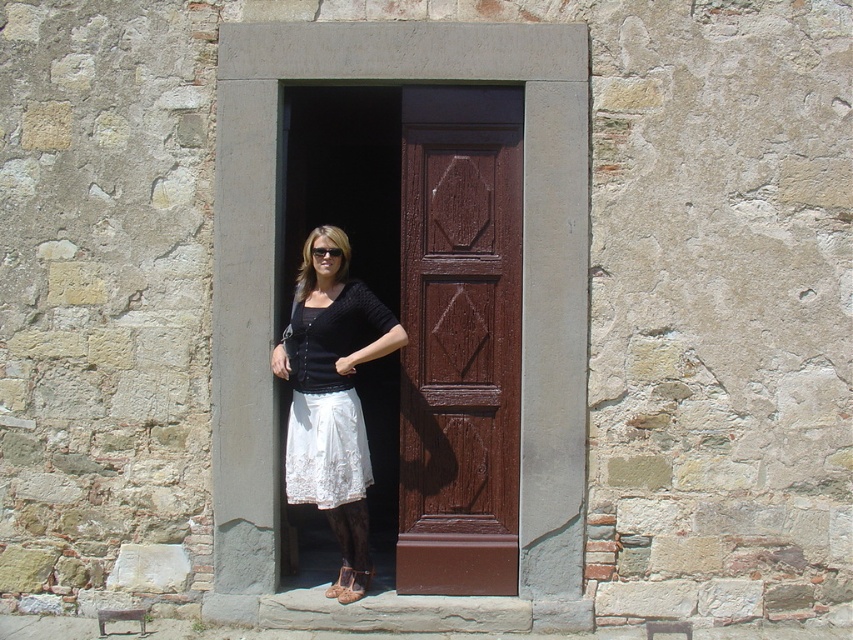
You are a painter who needs to hang a picture frame that is 1 meter tall on the wall between the brown wooden door at center and the black plastic goggles at center. Based on their positions, where should you place the top of the frame to ensure it fits without overlapping either object?

The brown wooden door at center is below the black plastic goggles at center. To fit the frame between them, place the top of the frame just below the black plastic goggles at center so the bottom of the frame is above the brown wooden door at center, ensuring the 1 meter height fits within the space between them.